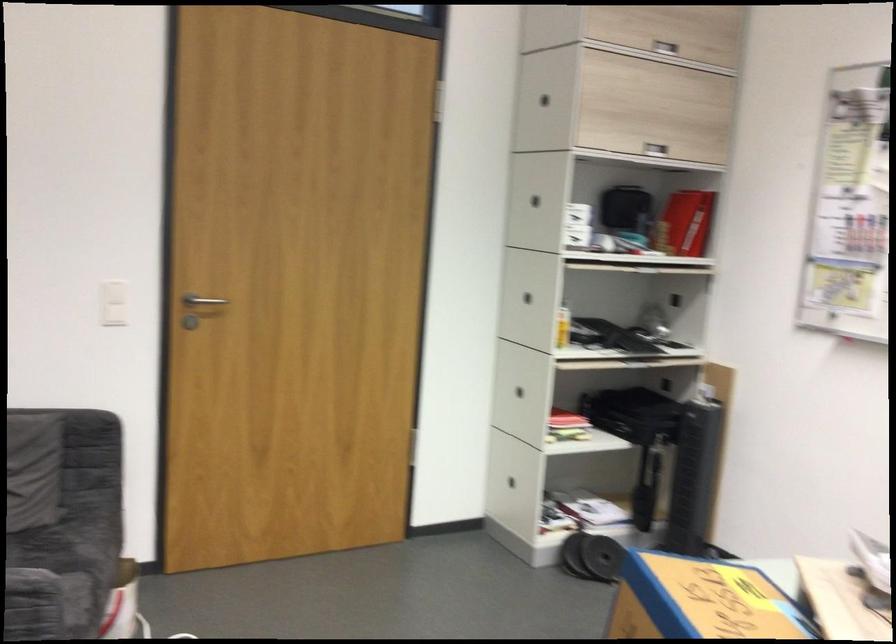
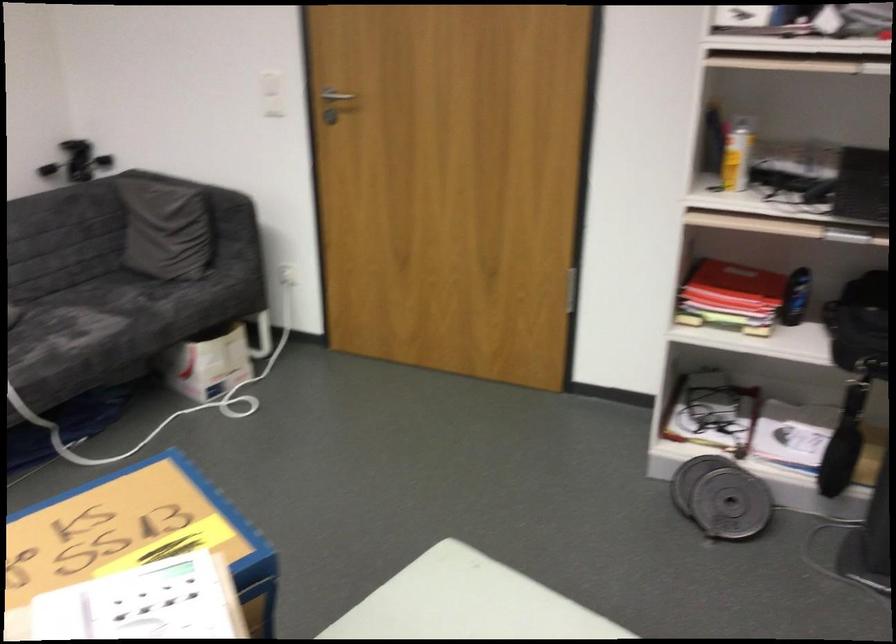
Where in the second image is the point corresponding to the point at 194,305 from the first image?

(331, 98)